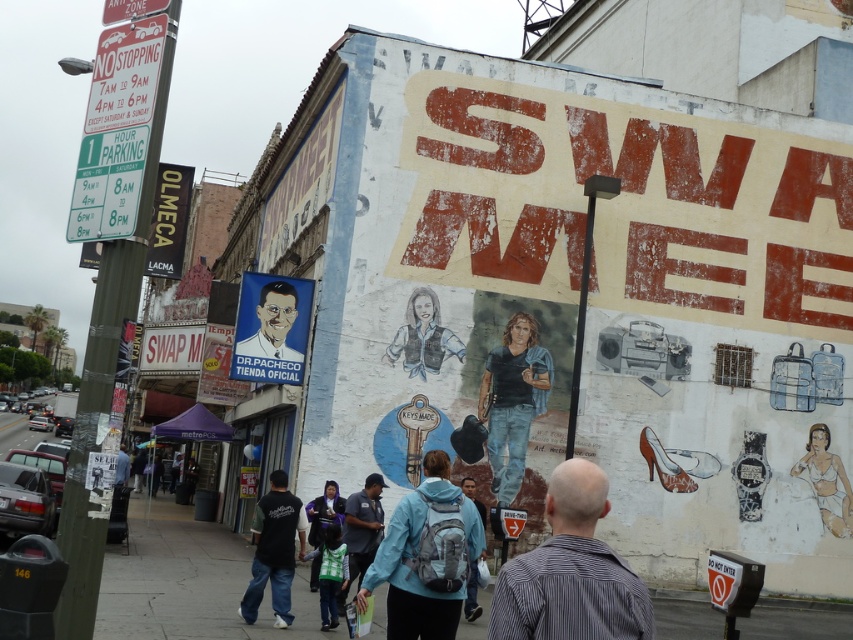
Which is more to the left, dark blue shirt at center or blue fabric jacket at center?

dark blue shirt at center is more to the left.

Which is in front, point (352, 531) or point (471, 483)?

Point (352, 531) is in front.

Which is behind, point (381, 477) or point (480, 612)?

Point (381, 477)

This screenshot has height=640, width=853. Find the location of `dark blue shirt at center`. dark blue shirt at center is located at coordinates (x=363, y=529).

Can you confirm if matte blue jacket at center is shorter than matte purple jacket at center?

Yes.

In the scene shown: Can you confirm if matte blue jacket at center is positioned below matte purple jacket at center?

Actually, matte blue jacket at center is above matte purple jacket at center.

Who is more distant from viewer, (405, 513) or (311, 576)?

Point (311, 576)

This screenshot has height=640, width=853. Find the location of `matte blue jacket at center`. matte blue jacket at center is located at coordinates pyautogui.click(x=415, y=557).

How distant is colored pencil drawing of a person at center from dark blue shirt at center?

A distance of 8.76 meters exists between colored pencil drawing of a person at center and dark blue shirt at center.

Which is above, colored pencil drawing of a person at center or dark blue shirt at center?

Positioned higher is colored pencil drawing of a person at center.

Find the location of a particular element. The height and width of the screenshot is (640, 853). colored pencil drawing of a person at center is located at coordinates (422, 337).